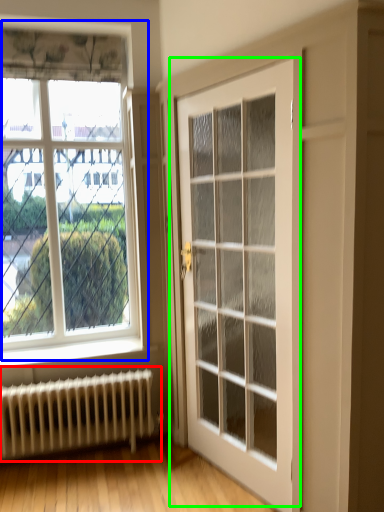
Question: Based on their relative distances, which object is nearer to radiator (highlighted by a red box)? Choose from window (highlighted by a blue box) and door (highlighted by a green box).

Choices:
 (A) window
 (B) door

Answer: (A)